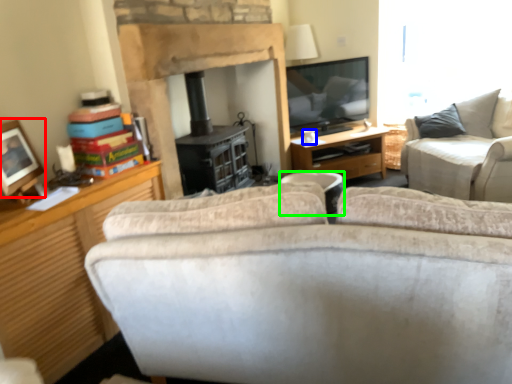
Question: Considering the real-world distances, which object is closest to picture frame (highlighted by a red box)? coffee cup (highlighted by a blue box) or trash bin/can (highlighted by a green box).

Choices:
 (A) coffee cup
 (B) trash bin/can

Answer: (B)